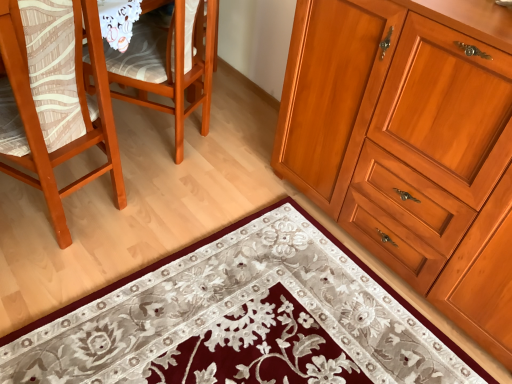
At what (x,y) coordinates should I click in order to perform the action: click on empty space that is to the right of matte wood chair at left, the second chair when ordered from right to left. Please return your answer as a coordinate pair (x, y). Looking at the image, I should click on (152, 225).